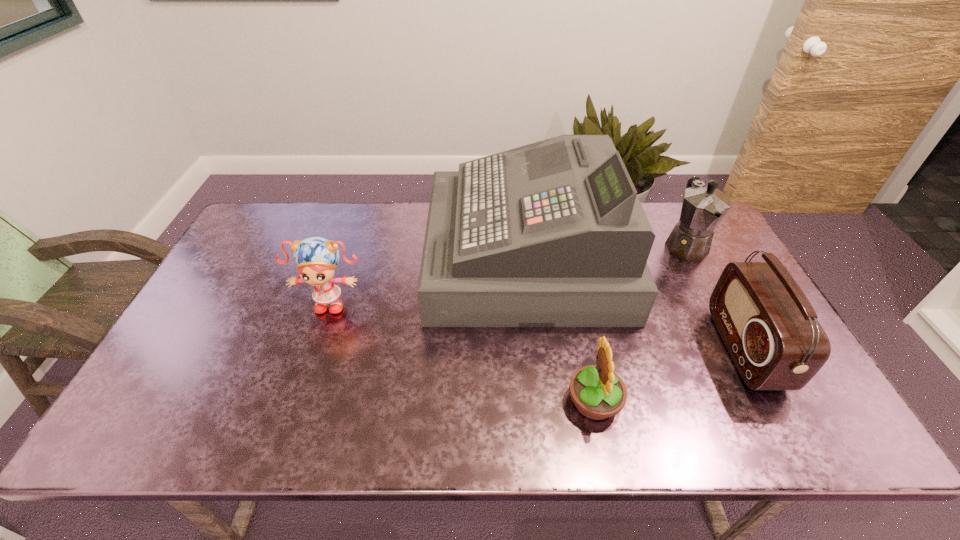
Point out which object is positioned as the third nearest to the tallest object. Please provide its 2D coordinates. Your answer should be formatted as a tuple, i.e. [(x, y)], where the tuple contains the x and y coordinates of a point satisfying the conditions above.

[(316, 258)]

This screenshot has width=960, height=540. What are the coordinates of `vacant region that satisfies the following two spatial constraints: 1. on the pouring side of the coffeepot; 2. on the face of the sunflower` in the screenshot? It's located at (766, 401).

Find the location of `vacant space that satisfies the following two spatial constraints: 1. on the front-facing side of the tallest object; 2. on the face of the doll`. vacant space that satisfies the following two spatial constraints: 1. on the front-facing side of the tallest object; 2. on the face of the doll is located at coordinates (530, 301).

Where is `blank space that satisfies the following two spatial constraints: 1. on the pouring side of the coffeepot; 2. on the front-facing side of the cash register`? The height and width of the screenshot is (540, 960). blank space that satisfies the following two spatial constraints: 1. on the pouring side of the coffeepot; 2. on the front-facing side of the cash register is located at coordinates (x=692, y=257).

Identify the location of vacant space that satisfies the following two spatial constraints: 1. on the pouring side of the coffeepot; 2. on the front-facing side of the cash register. (692, 257).